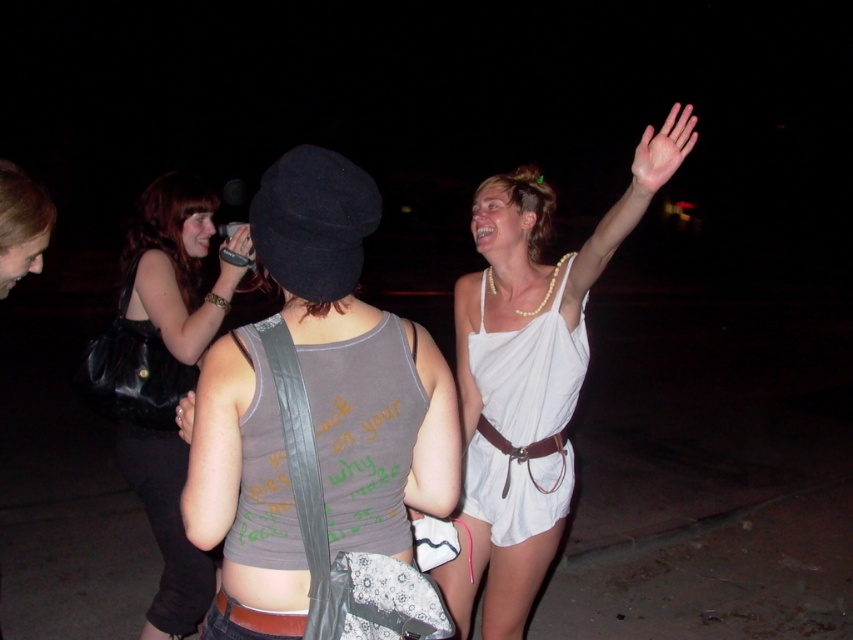
You are standing at the point labeled point (276, 460) in a dark nighttime scene with two women and a partially visible person. You want to take a photo of the woman in the white sleeveless toga outfit who is on the right side. Will the camera, which is 1.35 meters away from your current position, be able to capture her in the frame?

The camera is 1.35 meters away from the point (276, 460). Since the woman in the white sleeveless toga is positioned on the right side of the frame, the camera should be able to capture her in the frame as long as the distance is within the camera lens range. However, the description does not specify the camera lens range, so we can only confirm the distance between the camera and the point is 1.35 meters.

You are a photographer trying to capture a clear photo of the white fabric dress at upper right and the matte black purse at left. Since the scene is dimly lit, you need to adjust your camera settings. Considering their sizes, which object should you focus on first to ensure proper exposure?

The white fabric dress at upper right has a larger size compared to the matte black purse at left, so you should focus on the white fabric dress at upper right first to ensure proper exposure.